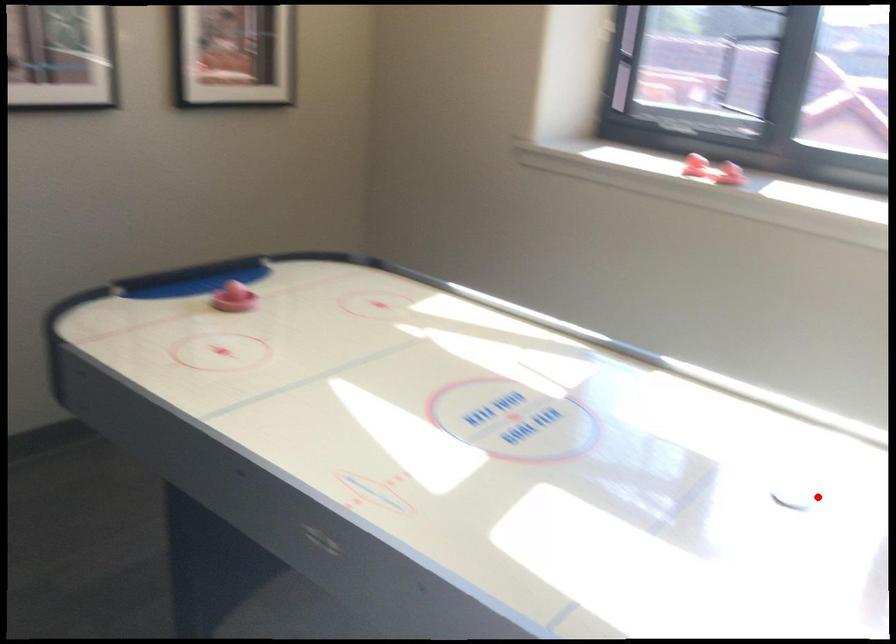
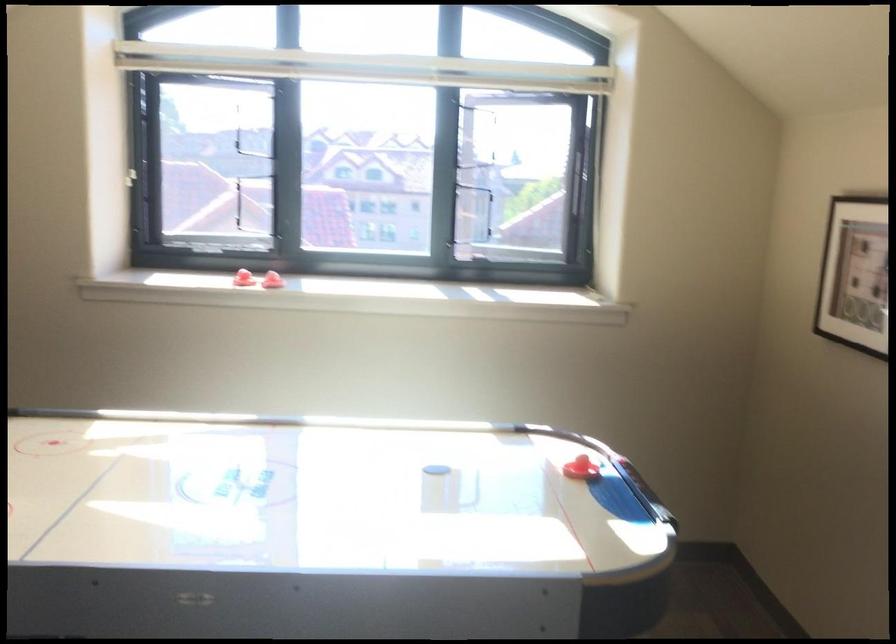
Where in the second image is the point corresponding to the highlighted location from the first image?

(442, 467)